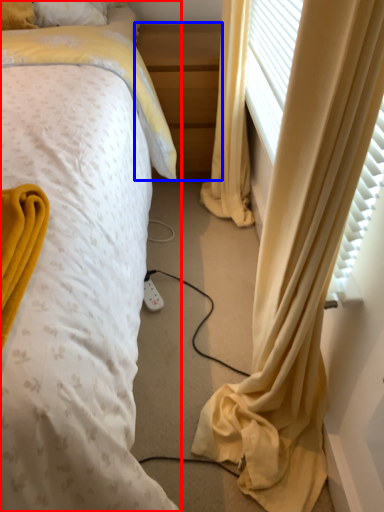
Question: Which object is closer to the camera taking this photo, bed (highlighted by a red box) or nightstand (highlighted by a blue box)?

Choices:
 (A) bed
 (B) nightstand

Answer: (A)